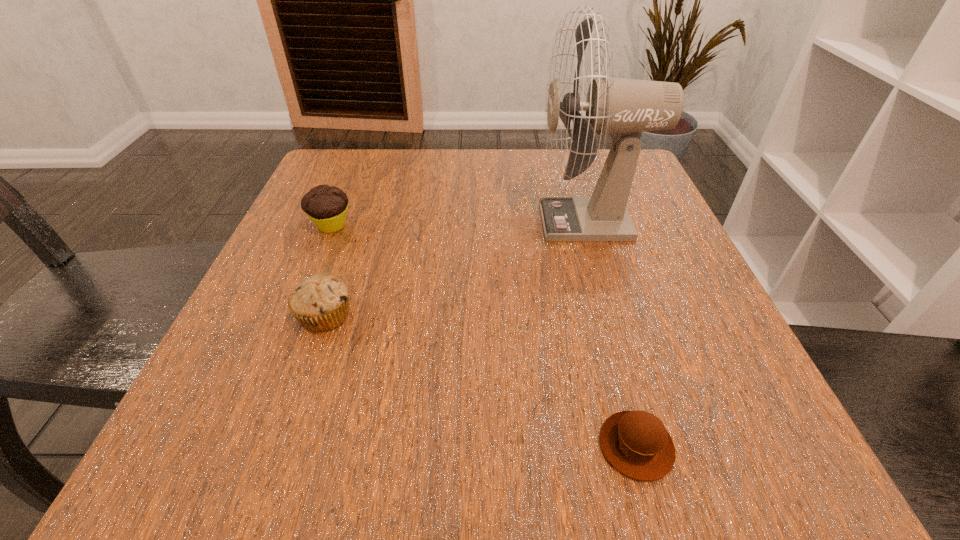
In the image, there is a desktop. At what (x,y) coordinates should I click in order to perform the action: click on blank space at the right edge. Please return your answer as a coordinate pair (x, y). The height and width of the screenshot is (540, 960). Looking at the image, I should click on pyautogui.click(x=631, y=210).

You are a GUI agent. You are given a task and a screenshot of the screen. Output one action in this format:
    pyautogui.click(x=<x>, y=<y>)
    Task: Click on the free region at the far left corner of the desktop
    
    Given the screenshot: What is the action you would take?
    pyautogui.click(x=391, y=153)

Image resolution: width=960 pixels, height=540 pixels. What are the coordinates of `free space at the near left corner` in the screenshot? It's located at (244, 476).

You are a GUI agent. You are given a task and a screenshot of the screen. Output one action in this format:
    pyautogui.click(x=<x>, y=<y>)
    Task: Click on the blank space at the far right corner of the desktop
    This screenshot has height=540, width=960.
    Given the screenshot: What is the action you would take?
    pyautogui.click(x=596, y=166)

The image size is (960, 540). Find the location of `vacant space that is in between the tallest object and the shortest muffin`. vacant space that is in between the tallest object and the shortest muffin is located at coordinates (612, 334).

The height and width of the screenshot is (540, 960). I want to click on vacant space that is in between the tallest object and the shortest muffin, so click(x=612, y=334).

Where is `blank region between the tallest object and the farthest muffin`? The width and height of the screenshot is (960, 540). blank region between the tallest object and the farthest muffin is located at coordinates (461, 224).

The height and width of the screenshot is (540, 960). I want to click on unoccupied area between the nearest object and the third farthest object, so click(x=481, y=381).

What are the coordinates of `empty location between the second farthest muffin and the farthest muffin` in the screenshot? It's located at (328, 271).

Locate an element on the screen. The width and height of the screenshot is (960, 540). empty space that is in between the tallest object and the third farthest object is located at coordinates (457, 268).